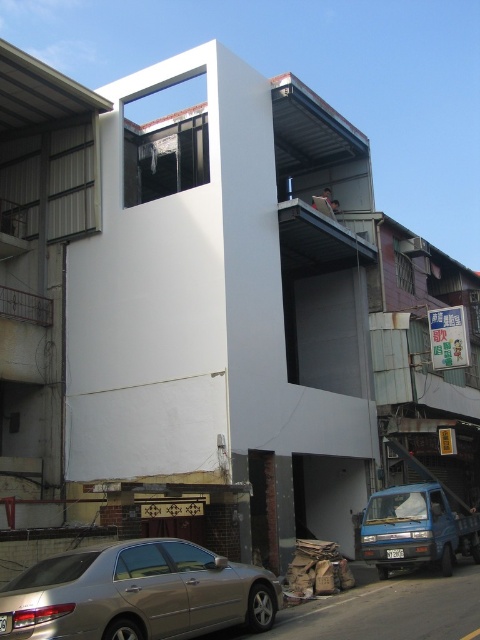
You are standing at the center of the image. Which direction should you face to see the gold metallic car at lower left?

You should face the lower left direction to see the gold metallic car at lower left.

You are a delivery driver who needs to park your vehicle between the gold metallic car at lower left and the blue matte van at lower right. Can you fit your truck which is 2 meters wide into the space between them?

The gold metallic car at lower left is positioned on the left side of blue matte van at lower right, but the exact distance between them isn not provided. Without knowing the width of the space, it is impossible to determine if the truck can fit.